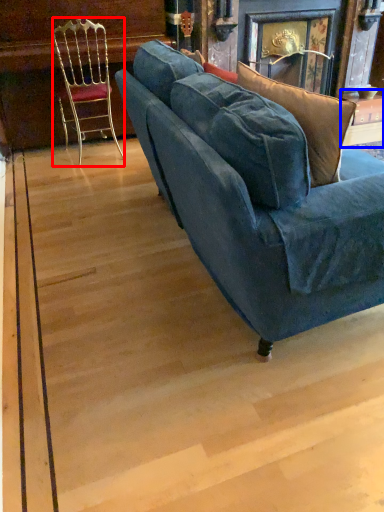
Question: Which object is closer to the camera taking this photo, chair (highlighted by a red box) or table (highlighted by a blue box)?

Choices:
 (A) chair
 (B) table

Answer: (A)